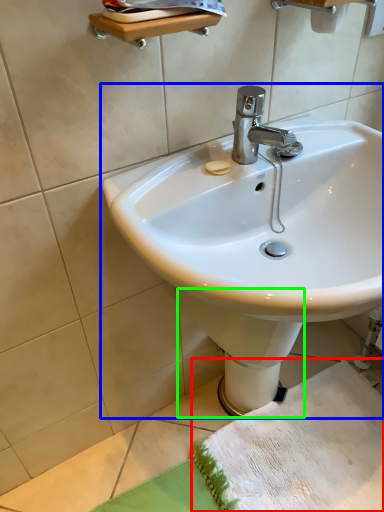
Question: Which object is the farthest from beach towel (highlighted by a red box)? Choose among these: sink (highlighted by a blue box) or bidet (highlighted by a green box).

Choices:
 (A) sink
 (B) bidet

Answer: (A)